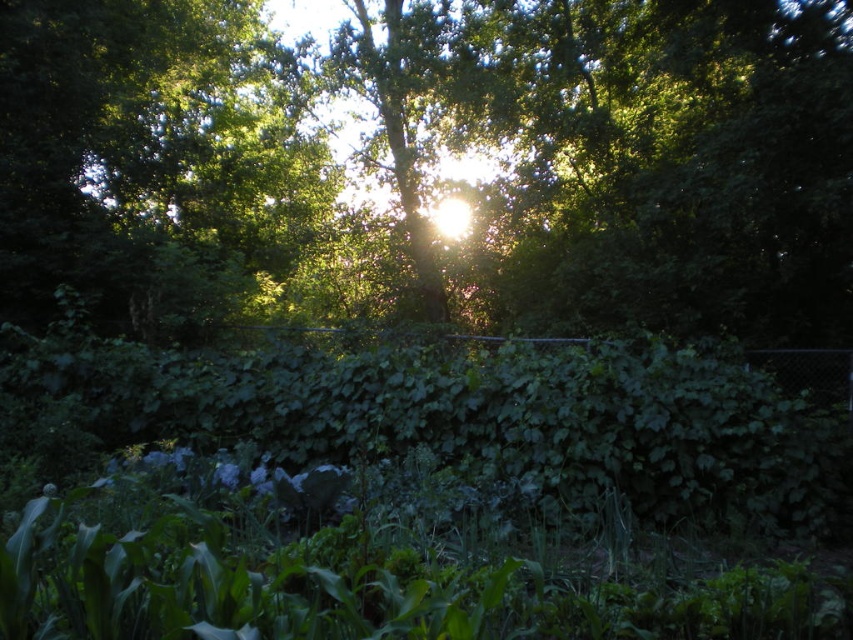
You are standing at the origin point in the center of the image. There are two points marked in the scene, point (460, 257) and point (289, 417). Which point is closer to you?

Point (289, 417) is closer to you because it is in front of point (460, 257).

You are standing 25 feet away from the green leafy tree at center. Can you reach the tree without moving closer?

The green leafy tree at center is 27.30 feet away from the camera, so if you are standing 25 feet away from it, you are actually closer than the camera and can reach the tree without moving further forward.

You are standing in the middle of the scene and want to walk towards the green leafy tree at center and the green leafy hedge at center. Which one is taller?

The green leafy tree at center is taller than the green leafy hedge at center.